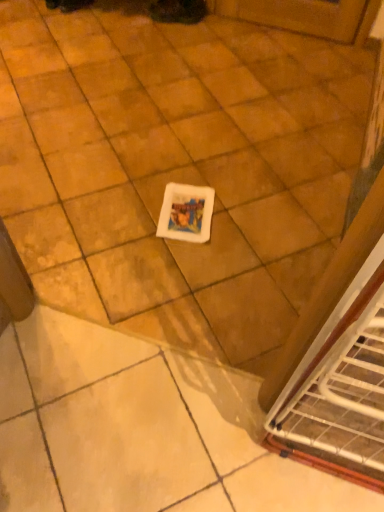
At what (x,y) coordinates should I click in order to perform the action: click on empty space that is ontop of white matte tile at center (from a real-world perspective). Please return your answer as a coordinate pair (x, y). Looking at the image, I should click on (139, 114).